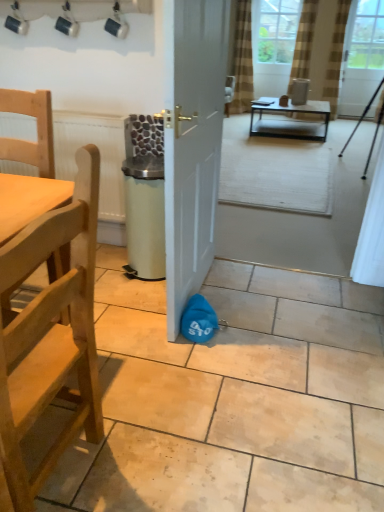
Question: Which direction should I rotate to look at clear glass window screen at upper center, which is the first window screen in left-to-right order?

Choices:
 (A) left
 (B) right

Answer: (B)

Question: Is brown striped curtain at upper center, arranged as the 3th curtain when viewed from the right, a part of light wood/rough chair at left, which ranks as the first chair in top-to-bottom order?

Choices:
 (A) yes
 (B) no

Answer: (B)

Question: Can you confirm if light wood/rough chair at left, which is the 2th chair in bottom-to-top order, is wider than brown striped curtain at upper center, arranged as the 3th curtain when viewed from the right?

Choices:
 (A) no
 (B) yes

Answer: (B)

Question: Is brown striped curtain at upper center, arranged as the 3th curtain when viewed from the right, at the back of light wood/rough chair at left, which ranks as the first chair in top-to-bottom order?

Choices:
 (A) no
 (B) yes

Answer: (B)

Question: Does light wood/rough chair at left, which ranks as the first chair in top-to-bottom order, have a larger size compared to brown striped curtain at upper center, arranged as the 3th curtain when viewed from the right?

Choices:
 (A) no
 (B) yes

Answer: (A)

Question: From a real-world perspective, is light wood/rough chair at left, which is the 2th chair in bottom-to-top order, located higher than brown striped curtain at upper center, which appears as the 1th curtain when viewed from the left?

Choices:
 (A) no
 (B) yes

Answer: (A)

Question: From a real-world perspective, is light wood/rough chair at left, which ranks as the first chair in top-to-bottom order, below brown striped curtain at upper center, arranged as the 3th curtain when viewed from the right?

Choices:
 (A) no
 (B) yes

Answer: (B)

Question: Are brown textured curtain at upper center, which is counted as the 2th curtain, starting from the right, and clear glass window screen at upper center, which is the first window screen in left-to-right order, beside each other?

Choices:
 (A) yes
 (B) no

Answer: (B)

Question: Is brown textured curtain at upper center, placed as the 2th curtain when sorted from left to right, further to the viewer compared to clear glass window screen at upper center, which is the first window screen in left-to-right order?

Choices:
 (A) no
 (B) yes

Answer: (A)

Question: Does brown textured curtain at upper center, placed as the 2th curtain when sorted from left to right, have a greater width compared to clear glass window screen at upper center, which is the first window screen in left-to-right order?

Choices:
 (A) yes
 (B) no

Answer: (A)

Question: Is brown textured curtain at upper center, which is counted as the 2th curtain, starting from the right, closer to camera compared to clear glass window screen at upper center, acting as the second window screen starting from the right?

Choices:
 (A) yes
 (B) no

Answer: (A)

Question: From the image's perspective, is brown textured curtain at upper center, placed as the 2th curtain when sorted from left to right, below clear glass window screen at upper center, acting as the second window screen starting from the right?

Choices:
 (A) no
 (B) yes

Answer: (B)

Question: Is brown textured curtain at upper center, which is counted as the 2th curtain, starting from the right, at the left side of clear glass window screen at upper center, which is the first window screen in left-to-right order?

Choices:
 (A) yes
 (B) no

Answer: (B)

Question: From a real-world perspective, is brown striped curtain at upper center, which appears as the 1th curtain when viewed from the left, physically above light wood/rough chair at left, which ranks as the first chair in top-to-bottom order?

Choices:
 (A) no
 (B) yes

Answer: (B)